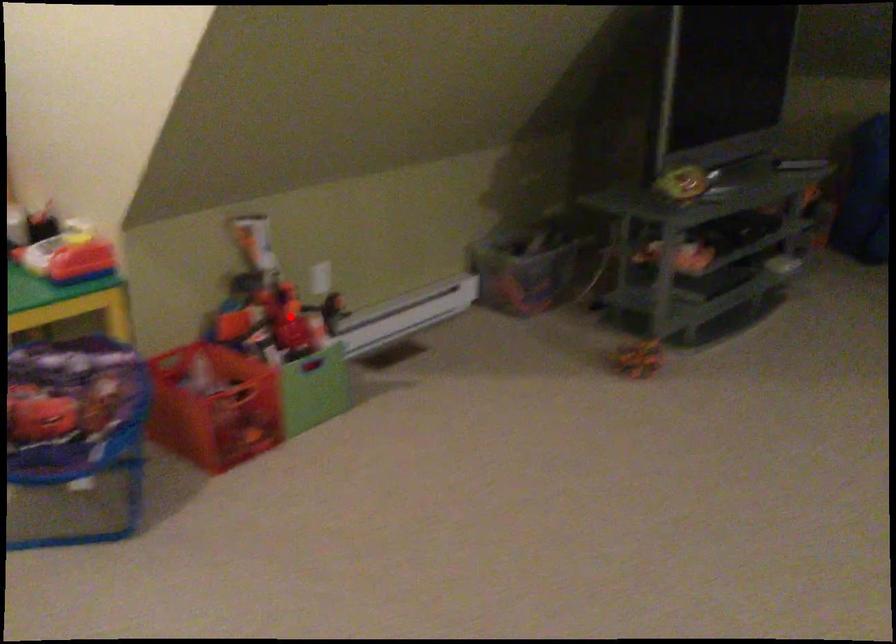
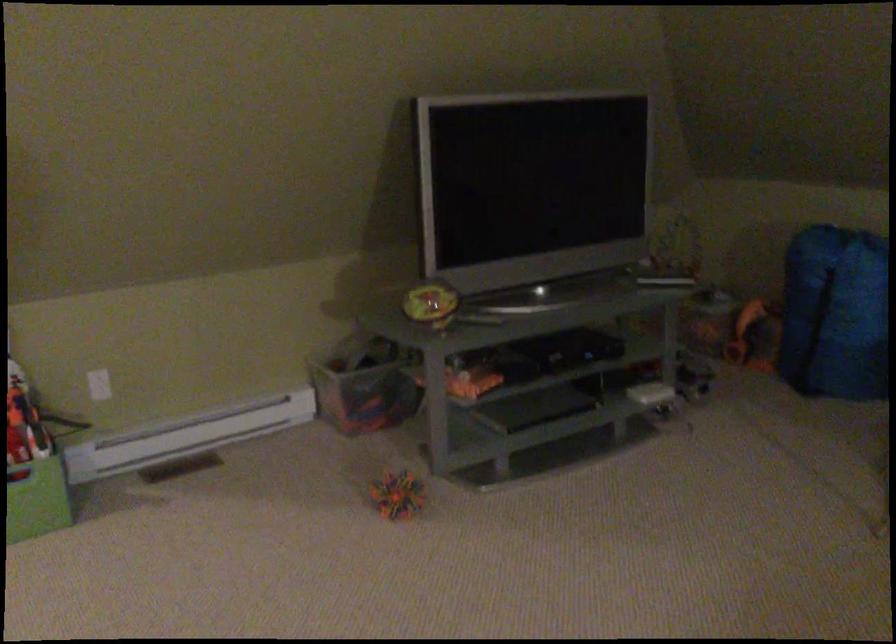
Where in the second image is the point corresponding to the highlighted location from the first image?

(23, 426)